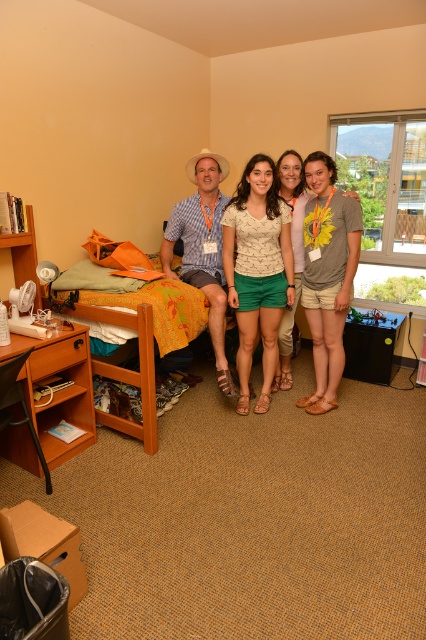
Please describe the location of the point with coordinates (258, 308) in the image. Is it on the matte white shirt at center?

Yes, the point with coordinates (258, 308) is located on the matte white shirt at center.

You are standing in the dormitory room and want to take a photo of the matte white blouse at center. Where should you position yourself to capture it in the frame?

To capture the matte white blouse at center in the frame, position yourself facing the center of the room where the blouse is located at coordinates approximately 0.423 on the horizontal axis and 0.606 on the vertical axis.